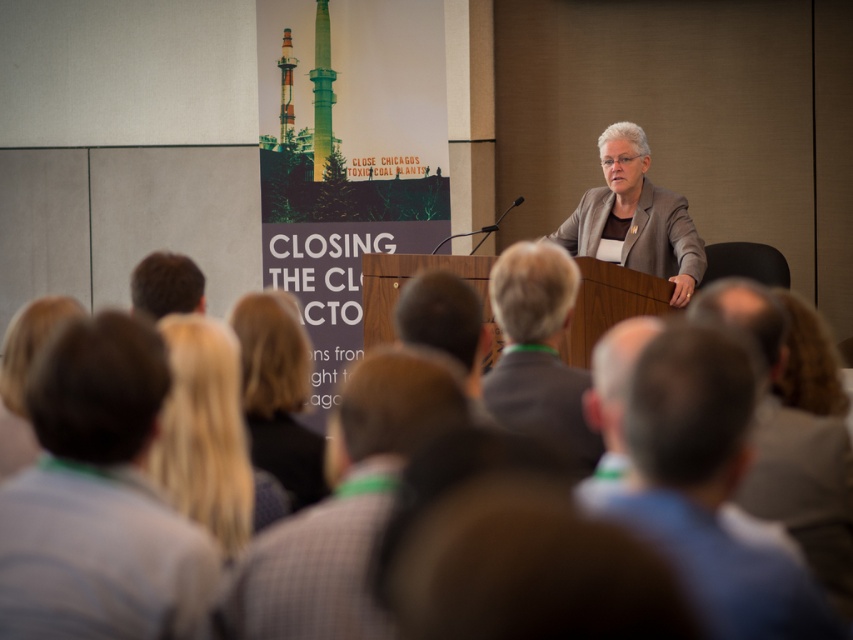
Who is more distant from viewer, (706,506) or (619,202)?

Positioned behind is point (619,202).

Who is shorter, gray fabric shirt at lower right or gray fabric jacket at center?

With less height is gray fabric shirt at lower right.

This screenshot has height=640, width=853. Describe the element at coordinates (706, 488) in the screenshot. I see `gray fabric shirt at lower right` at that location.

The image size is (853, 640). I want to click on gray fabric shirt at lower right, so click(x=706, y=488).

The width and height of the screenshot is (853, 640). I want to click on gray fabric jacket at center, so click(634, 218).

Can you confirm if gray fabric jacket at center is taller than dark brown hair at center?

Yes, gray fabric jacket at center is taller than dark brown hair at center.

Find the location of a particular element. The image size is (853, 640). gray fabric jacket at center is located at coordinates (634, 218).

Looking at this image, measure the distance from gray hair at upper center to blonde hair at lower left.

They are 1.33 meters apart.

Which is more to the right, gray hair at upper center or blonde hair at lower left?

gray hair at upper center is more to the right.

This screenshot has height=640, width=853. I want to click on gray hair at upper center, so click(612, 404).